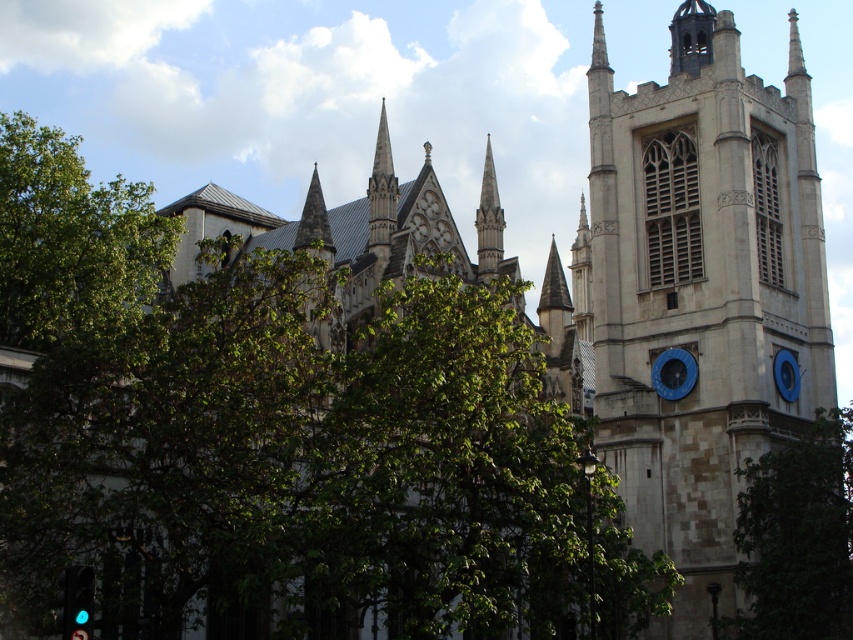
You are a maintenance worker needing to reach both the green leafy tree at right and the blue painted metal clock at right. If your ladder is 12 meters long, can you use it to move from one to the other?

The distance between the green leafy tree at right and the blue painted metal clock at right is 12.14 meters, which is slightly longer than the ladder. Therefore, you cannot use the ladder to move between them.

You are standing in a park and see the stone clock tower at upper right. If you walk straight towards it, will you first encounter the lush green trees in the foreground before reaching the clock tower?

The stone clock tower at upper right is 69.05 meters from the camera. Since the lush green trees are in the foreground, they are closer to you than the clock tower. Therefore, you will first encounter the lush green trees before reaching the clock tower.

You are standing in front of the historic Gothic building and want to take a photo that includes the point at coordinates point (x=775, y=506). If your camera has a maximum focus range of 60 meters, will you be able to focus on that point?

The distance of point (x=775, y=506) from the camera is 67.21 meters, which exceeds the camera maximum focus range of 60 meters. Therefore, the camera cannot focus on that point.